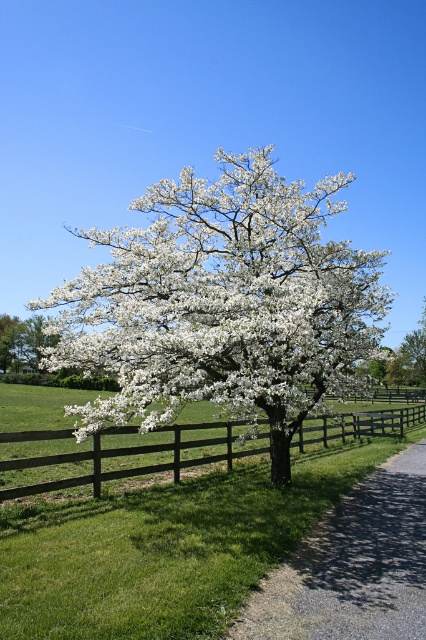
How much distance is there between brown wooden fence at center and white blossoming tree at center?

The distance of brown wooden fence at center from white blossoming tree at center is 53.13 meters.

Does brown wooden fence at center lie in front of white blossoming tree at center?

Yes, brown wooden fence at center is in front of white blossoming tree at center.

Locate an element on the screen. brown wooden fence at center is located at coordinates (129, 456).

Can you confirm if gravel at lower right is wider than brown wooden fence at center?

In fact, gravel at lower right might be narrower than brown wooden fence at center.

Who is taller, gravel at lower right or brown wooden fence at center?

Standing taller between the two is brown wooden fence at center.

Who is more distant from viewer, (425, 532) or (357, 428)?

Positioned behind is point (357, 428).

You are a GUI agent. You are given a task and a screenshot of the screen. Output one action in this format:
    pyautogui.click(x=<x>, y=<y>)
    Task: Click on the gravel at lower right
    
    Given the screenshot: What is the action you would take?
    pyautogui.click(x=353, y=564)

Is white matte flower at center below brown wooden fence at center?

No, white matte flower at center is not below brown wooden fence at center.

Identify the location of white matte flower at center. This screenshot has height=640, width=426. (222, 301).